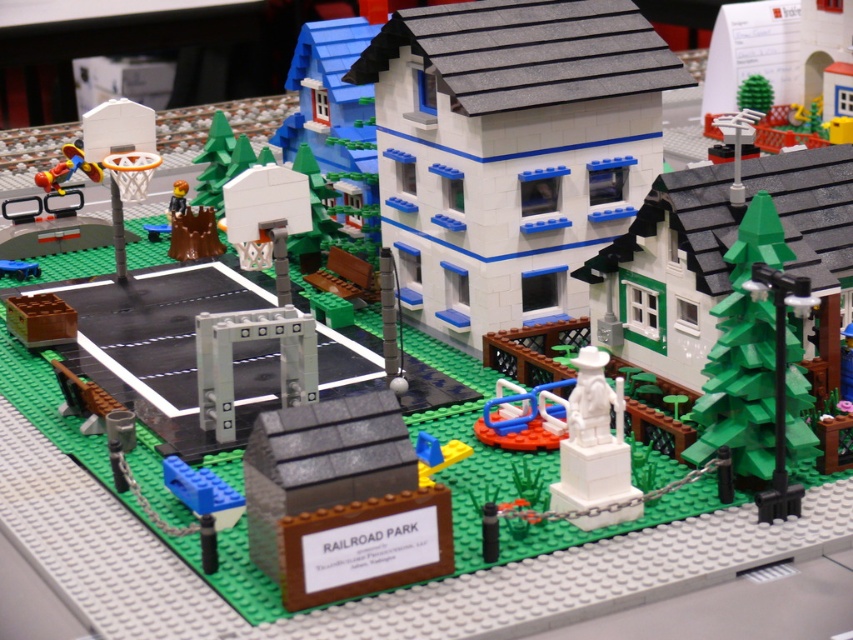
You are a visitor at the RAILROAD PARK and want to take a photo of the white matte building at center and the blue plastic toy at lower left. Which object should you focus on first if you want to capture both in a single frame without moving the camera?

The white matte building at center is much taller than the blue plastic toy at lower left, so you should focus on the white matte building at center first to ensure it fits within the frame.

Consider the image. You are a visitor at the RAILROAD PARK and want to take a photo of the white matte statue at center without the shiny plastic toy at left appearing in the background. Is this possible based on their positions?

The white matte statue at center is in front of the shiny plastic toy at left, so if you position yourself so that the statue blocks the view of the toy, you can take a photo without the shiny plastic toy at left in the background.

Consider the image. You are a visitor at the Railroad Park Lego model. You see the white matte statue at center. Where exactly is the statue positioned in the scene?

The white matte statue at center is located at point coordinates of (592,440).